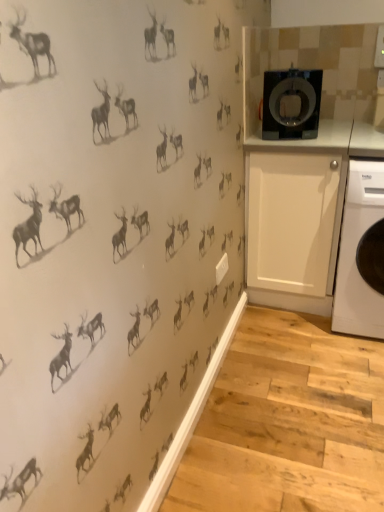
You are a GUI agent. You are given a task and a screenshot of the screen. Output one action in this format:
    pyautogui.click(x=<x>, y=<y>)
    Task: Click on the spots to the right of black glossy washing machine at upper right
    
    Given the screenshot: What is the action you would take?
    pyautogui.click(x=329, y=135)